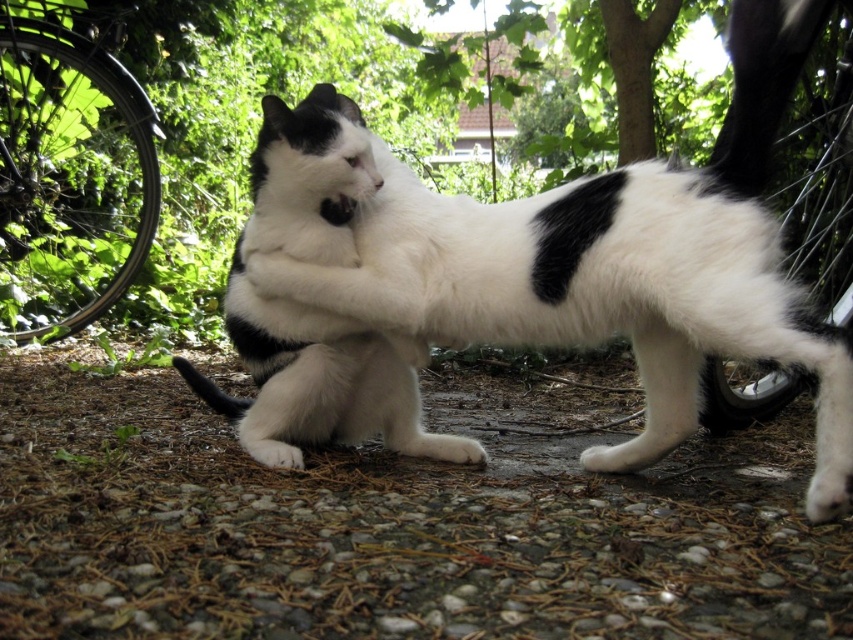
Question: Which of the following is the closest to the observer?

Choices:
 (A) black rubber tire at right
 (B) black rubber tire at left
 (C) black rubber tire at upper left

Answer: (A)

Question: Estimate the real-world distances between objects in this image. Which object is closer to the white soft fur cat at center?

Choices:
 (A) black rubber tire at upper left
 (B) black rubber tire at left
 (C) black rubber tire at right

Answer: (C)

Question: Does black rubber tire at upper left have a greater width compared to black rubber tire at right?

Choices:
 (A) yes
 (B) no

Answer: (A)

Question: Can you confirm if black rubber tire at upper left is wider than black rubber tire at left?

Choices:
 (A) yes
 (B) no

Answer: (B)

Question: Observing the image, what is the correct spatial positioning of white soft fur cat at center in reference to black rubber tire at right?

Choices:
 (A) above
 (B) below

Answer: (B)

Question: Which object appears farthest from the camera in this image?

Choices:
 (A) white soft fur cat at center
 (B) black rubber tire at left

Answer: (B)